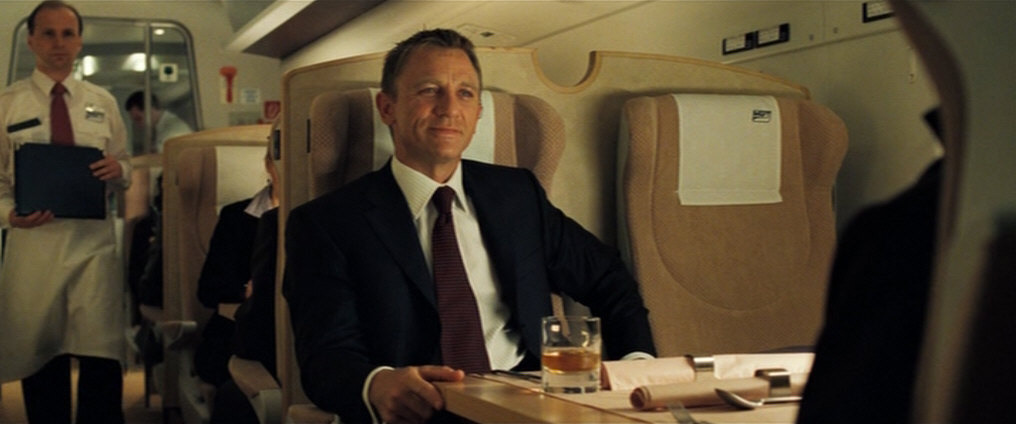
This screenshot has width=1016, height=424. In order to click on table in this screenshot , I will do `click(581, 420)`.